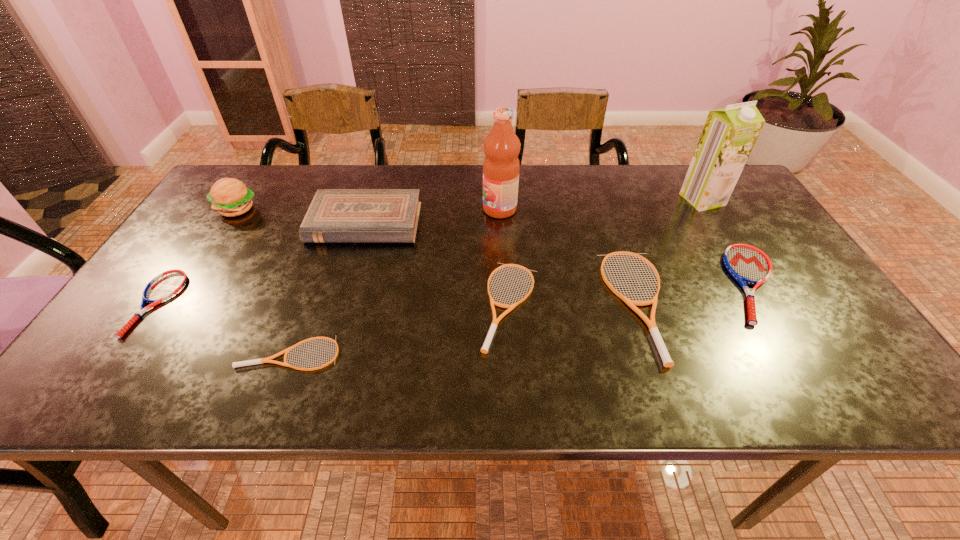
Where is `soya milk`? This screenshot has width=960, height=540. soya milk is located at coordinates (729, 134).

Image resolution: width=960 pixels, height=540 pixels. In order to click on fruit juice in this screenshot , I will do `click(501, 166)`.

Where is `hamburger`? hamburger is located at coordinates (229, 196).

Where is `the fourth tallest object`? The width and height of the screenshot is (960, 540). the fourth tallest object is located at coordinates (335, 215).

Locate an element on the screen. blue Bible is located at coordinates (335, 215).

This screenshot has width=960, height=540. In order to click on the biggest beige tennis racket in this screenshot , I will do `click(667, 361)`.

Identify the location of the seventh object from left to right. (667, 361).

You are a GUI agent. You are given a task and a screenshot of the screen. Output one action in this format:
    pyautogui.click(x=<x>, y=<y>)
    Task: Click on the rightmost tennis racket
    The height and width of the screenshot is (540, 960).
    Given the screenshot: What is the action you would take?
    pyautogui.click(x=747, y=264)

Where is `the bigger blue tennis racket`? The image size is (960, 540). the bigger blue tennis racket is located at coordinates (747, 264).

This screenshot has width=960, height=540. I want to click on the third tennis racket from left to right, so click(487, 342).